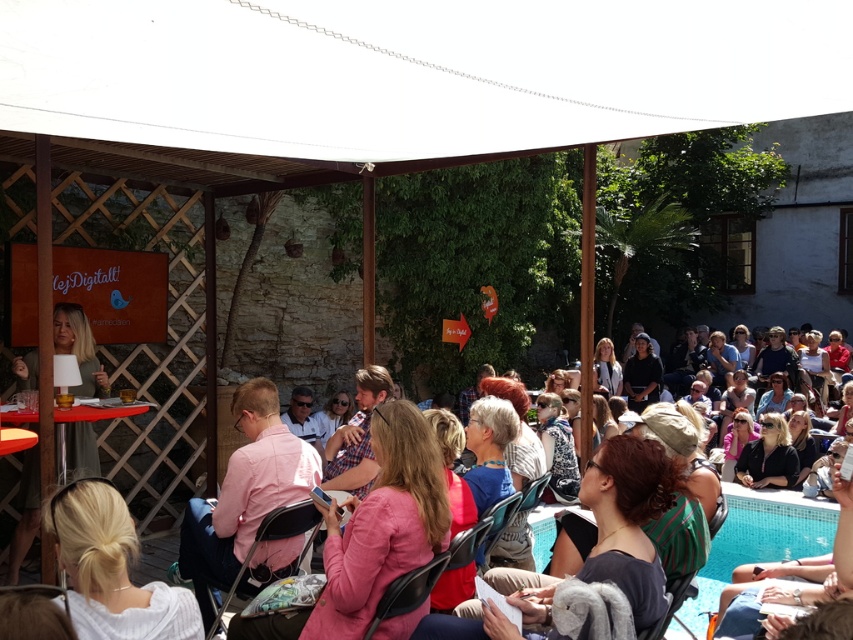
Question: Is pink fabric jacket at center positioned before matte pink shirt at center?

Choices:
 (A) no
 (B) yes

Answer: (B)

Question: Considering the real-world distances, which object is farthest from the matte pink shirt at center?

Choices:
 (A) pink fabric jacket at center
 (B) white fabric canopy at upper center

Answer: (B)

Question: Is white fabric canopy at upper center above pink fabric jacket at center?

Choices:
 (A) no
 (B) yes

Answer: (B)

Question: Can you confirm if white fabric canopy at upper center is positioned to the left of pink fabric jacket at center?

Choices:
 (A) yes
 (B) no

Answer: (A)

Question: Considering the real-world distances, which object is farthest from the white fabric canopy at upper center?

Choices:
 (A) pink fabric jacket at center
 (B) matte pink shirt at center

Answer: (B)

Question: Among these points, which one is farthest from the camera?

Choices:
 (A) (640, 483)
 (B) (665, 51)
 (C) (552, 538)

Answer: (C)